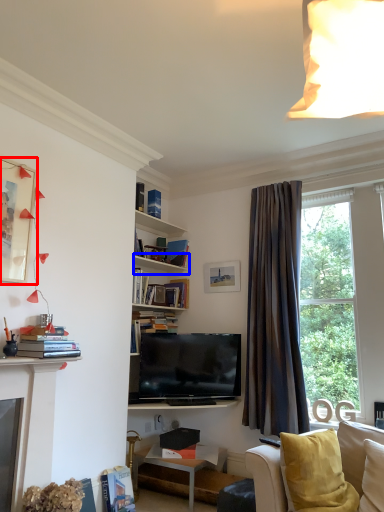
Question: Which of the following is the farthest to the observer, picture frame (highlighted by a red box) or shelf (highlighted by a blue box)?

Choices:
 (A) picture frame
 (B) shelf

Answer: (B)